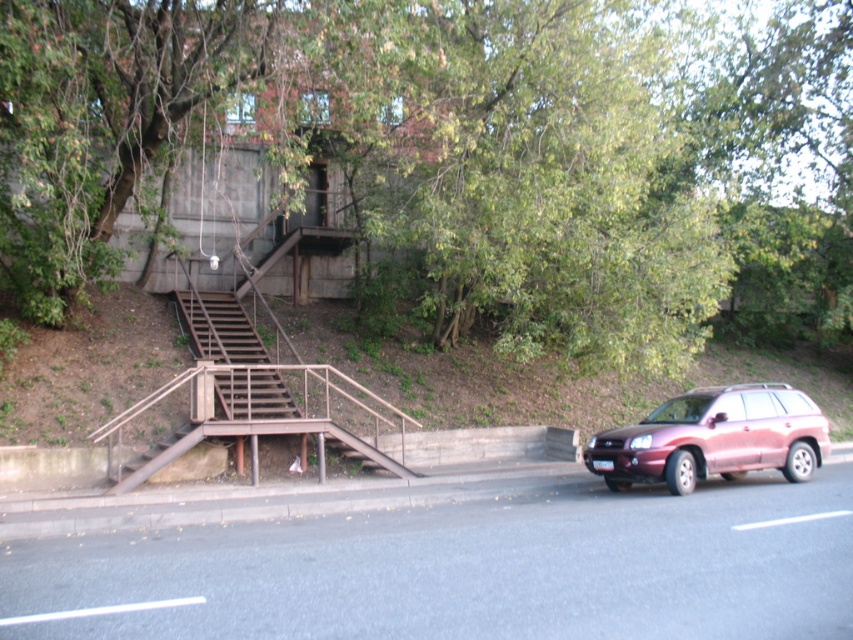
You are standing at the bottom of the brown wooden stairs at left and want to reach the building behind the green leafy tree at upper center. Which direction should you walk to get closer to the building?

The green leafy tree at upper center is located above the brown wooden stairs at left, so you should walk upwards along the brown wooden stairs at left to get closer to the building behind the tree.

You are a delivery person trying to navigate through the urban scene. You need to pass between the green leafy tree at upper center and the brown wooden stairs at left. Can you estimate if there is enough space for your delivery van, which is 2 meters wide?

The green leafy tree at upper center might be wider than brown wooden stairs at left, so there may not be enough space for the delivery van which is 2 meters wide. It is recommended to check the actual width before proceeding.

You are standing at the bottom of the staircase leading to the building. You want to take a photo of the building without any obstructions. Which direction should you move to avoid the green leafy tree at upper center?

Move to the left side of the staircase to avoid the green leafy tree at upper center, as the tree is located at the upper center position which is to the right of the staircase.